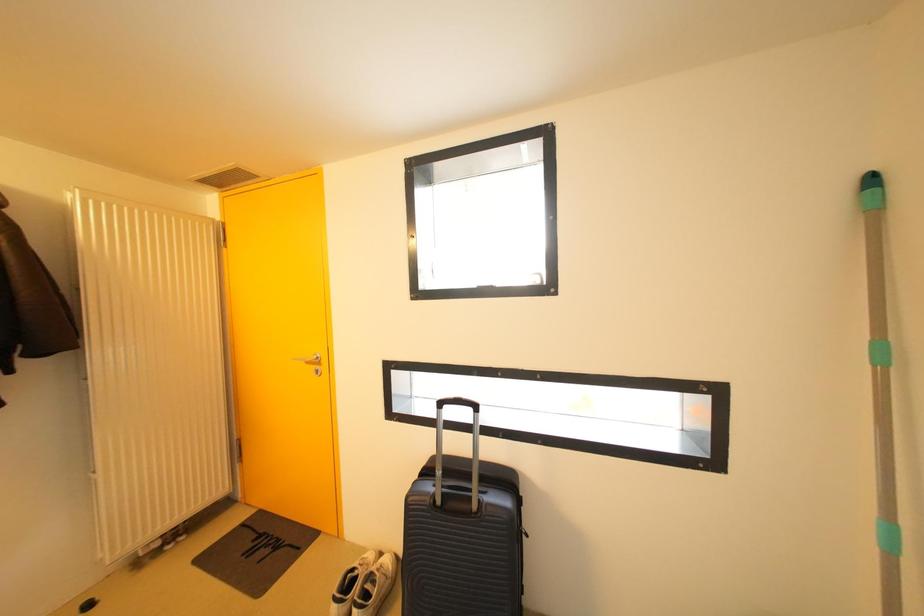
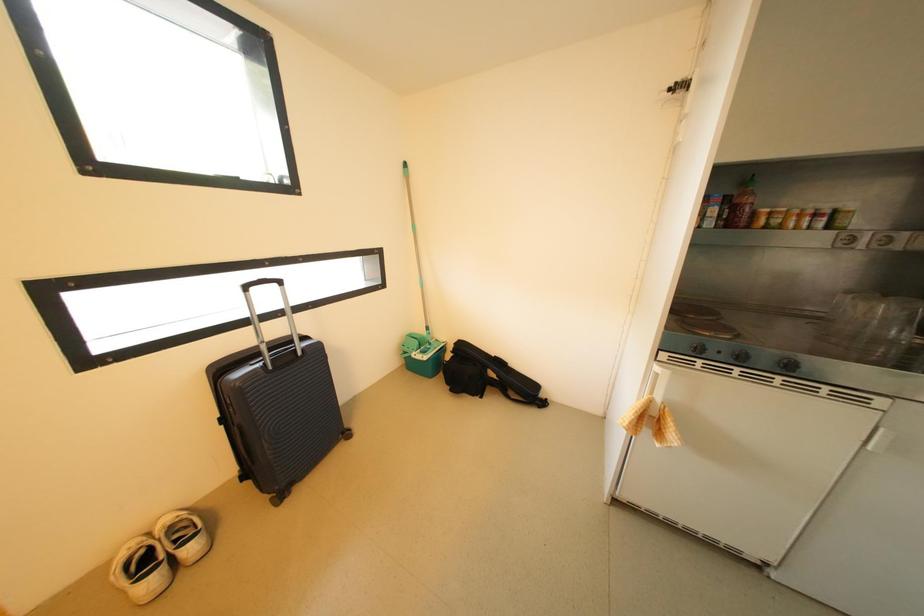
First-person continuous shooting, in which direction is the camera rotating?

The camera's rotation is toward right-down.